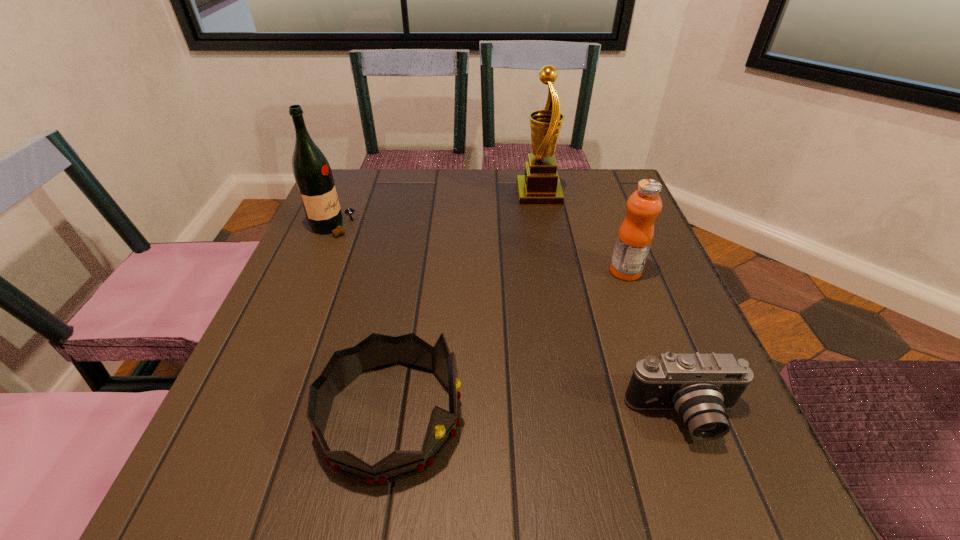
This screenshot has height=540, width=960. I want to click on free location at the far right corner, so click(623, 213).

Where is `free space between the award and the third tallest object`? This screenshot has height=540, width=960. free space between the award and the third tallest object is located at coordinates (582, 233).

This screenshot has height=540, width=960. I want to click on unoccupied position between the camera and the fourth tallest object, so click(x=538, y=417).

Where is `unoccupied area between the farthest object and the shortest object`? unoccupied area between the farthest object and the shortest object is located at coordinates (612, 306).

Where is `vacant space that's between the second farthest object and the third nearest object`? This screenshot has height=540, width=960. vacant space that's between the second farthest object and the third nearest object is located at coordinates (480, 249).

You are a GUI agent. You are given a task and a screenshot of the screen. Output one action in this format:
    pyautogui.click(x=<x>, y=<y>)
    Task: Click on the empty location between the shortest object and the leftmost object
    This screenshot has height=540, width=960.
    Given the screenshot: What is the action you would take?
    pyautogui.click(x=509, y=322)

What are the coordinates of `vacant point located between the fruit juice and the third object from right to left` in the screenshot? It's located at (582, 233).

At what (x,y) coordinates should I click in order to perform the action: click on vacant space in between the farthest object and the tiara. Please return your answer as a coordinate pair (x, y). Image resolution: width=960 pixels, height=540 pixels. Looking at the image, I should click on (465, 306).

Identify the location of empty location between the fruit juice and the fourth tallest object. (508, 344).

Identify the location of free space that is in between the fourth object from right to left and the leftmost object. (363, 322).